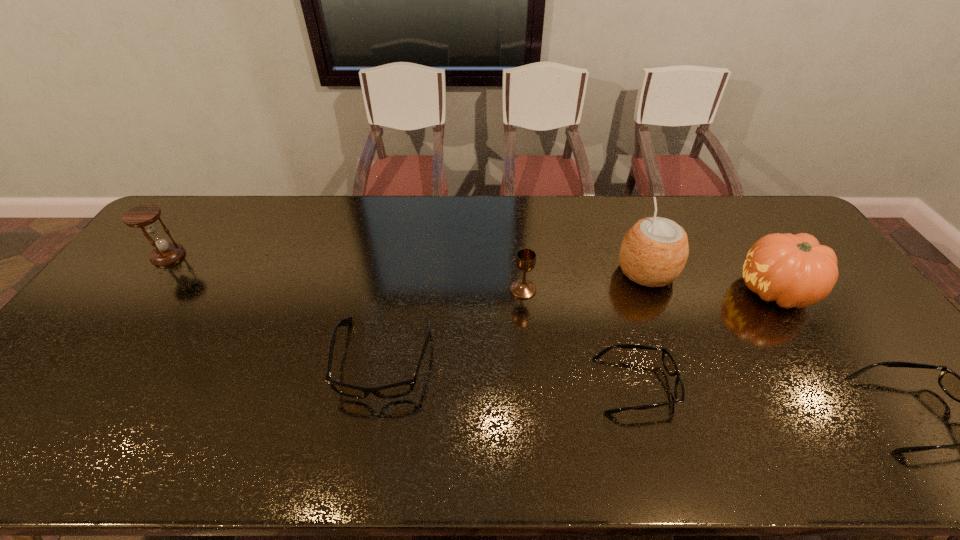
This screenshot has height=540, width=960. I want to click on the leftmost spectacles, so click(x=400, y=389).

Identify the location of the second spectacles from right to left. (668, 362).

Where is `the shortest object`? the shortest object is located at coordinates (668, 362).

The height and width of the screenshot is (540, 960). Find the location of `the leftmost object`. the leftmost object is located at coordinates click(x=144, y=216).

The width and height of the screenshot is (960, 540). I want to click on pumpkin, so click(x=795, y=270).

Identify the location of the fourth shortest object. This screenshot has height=540, width=960. (526, 258).

Identify the location of the third object from left to right. Image resolution: width=960 pixels, height=540 pixels. (526, 258).

Image resolution: width=960 pixels, height=540 pixels. I want to click on coconut, so click(x=653, y=253).

Identify the location of blank space located 0.350m on the front-facing side of the shortest object. point(816,384).

The height and width of the screenshot is (540, 960). What are the coordinates of `free space located 0.070m on the right of the hourglass` in the screenshot? It's located at (205, 255).